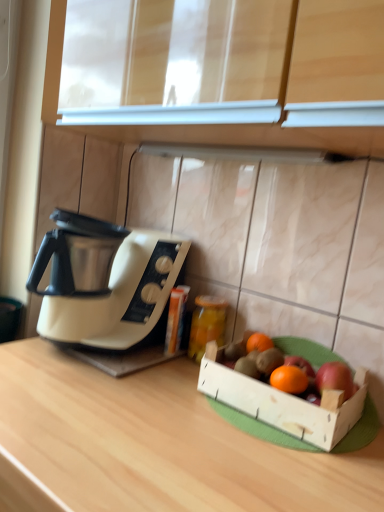
Question: From a real-world perspective, is orange matte grapefruit at center, marked as the first grapefruit in a back-to-front arrangement, above or below orange matte grapefruit at center, the 2th grapefruit from the back?

Choices:
 (A) below
 (B) above

Answer: (A)

Question: Considering the positions of point (256, 347) and point (306, 374), is point (256, 347) closer or farther from the camera than point (306, 374)?

Choices:
 (A) closer
 (B) farther

Answer: (B)

Question: Which object is the closest to the translucent glass jar at center?

Choices:
 (A) orange matte grapefruit at center, the 2th grapefruit from the back
 (B) white glossy exhaust hood at center
 (C) orange matte grapefruit at center, positioned as the 2th grapefruit in front-to-back order
 (D) wooden crate at right
 (E) wooden at center

Answer: (C)

Question: Which object is the closest to the red matte apple at right?

Choices:
 (A) translucent glass jar at center
 (B) orange matte grapefruit at center, marked as the first grapefruit in a back-to-front arrangement
 (C) white glossy exhaust hood at center
 (D) white plastic coffee maker at left
 (E) wooden crate at right

Answer: (E)